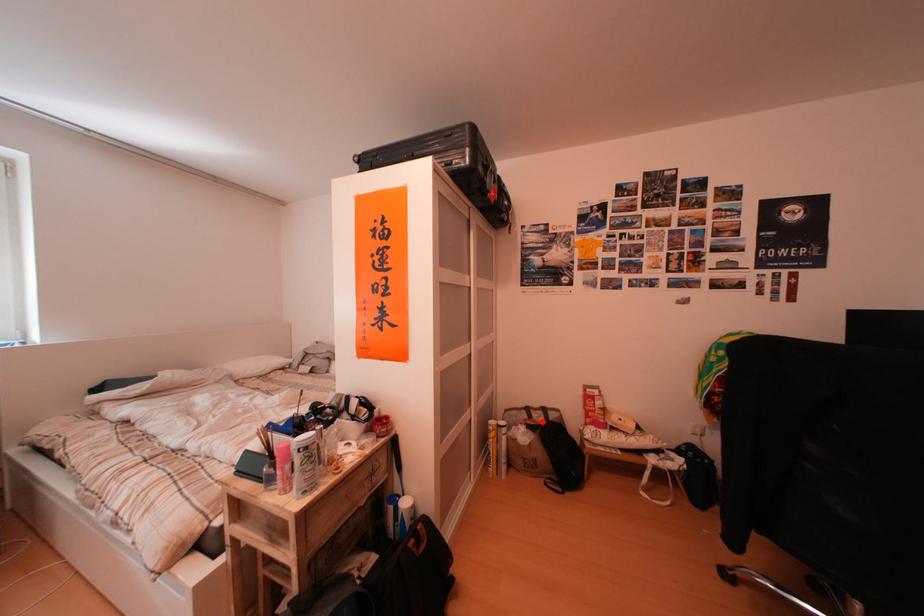
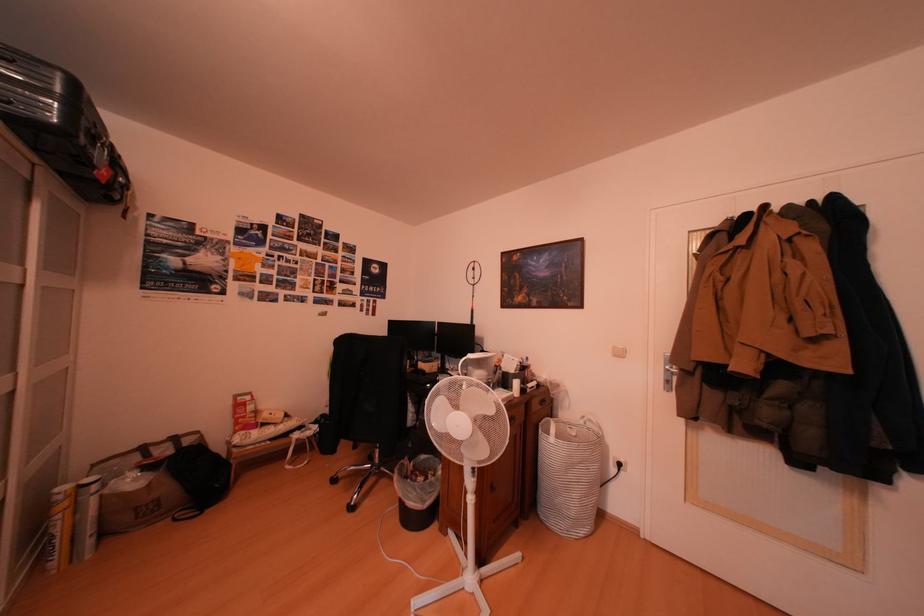
Where in the second image is the point corresponding to the highlighted location from the first image?

(161, 461)